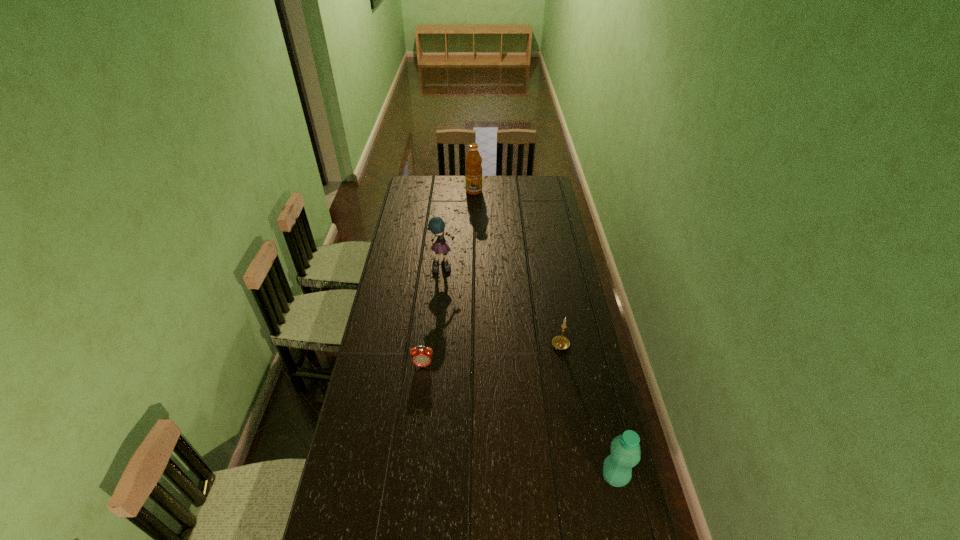
Where is `free space between the farthest object and the rightmost object`? The height and width of the screenshot is (540, 960). free space between the farthest object and the rightmost object is located at coordinates (544, 334).

The height and width of the screenshot is (540, 960). In order to click on free spot between the fourth farthest object and the third object from left to right in this screenshot , I will do click(x=448, y=278).

Find the location of `vacant area that lies between the bottle and the rag doll`. vacant area that lies between the bottle and the rag doll is located at coordinates 530,372.

You are a GUI agent. You are given a task and a screenshot of the screen. Output one action in this format:
    pyautogui.click(x=<x>, y=<y>)
    Task: Click on the free space that is in between the fourth nearest object and the second shortest object
    
    Given the screenshot: What is the action you would take?
    pyautogui.click(x=503, y=307)

At what (x,y) coordinates should I click in order to perform the action: click on free spot between the second nearest object and the rightmost object. Please return your answer as a coordinate pair (x, y). The image size is (960, 540). Looking at the image, I should click on (518, 421).

Find the location of a particular element. free space between the second farthest object and the farthest object is located at coordinates (459, 230).

Locate an element on the screen. This screenshot has width=960, height=540. empty space that is in between the third object from right to left and the rag doll is located at coordinates (459, 230).

Identify which object is located as the third nearest to the second shortest object. Please provide its 2D coordinates. Your answer should be formatted as a tuple, i.e. [(x, y)], where the tuple contains the x and y coordinates of a point satisfying the conditions above.

[(436, 225)]

Choose which object is the third nearest neighbor to the fourth nearest object. Please provide its 2D coordinates. Your answer should be formatted as a tuple, i.e. [(x, y)], where the tuple contains the x and y coordinates of a point satisfying the conditions above.

[(473, 171)]

Identify the location of free location that satisfies the following two spatial constraints: 1. on the back side of the fruit juice; 2. on the right side of the fourth nearest object. This screenshot has width=960, height=540. (451, 191).